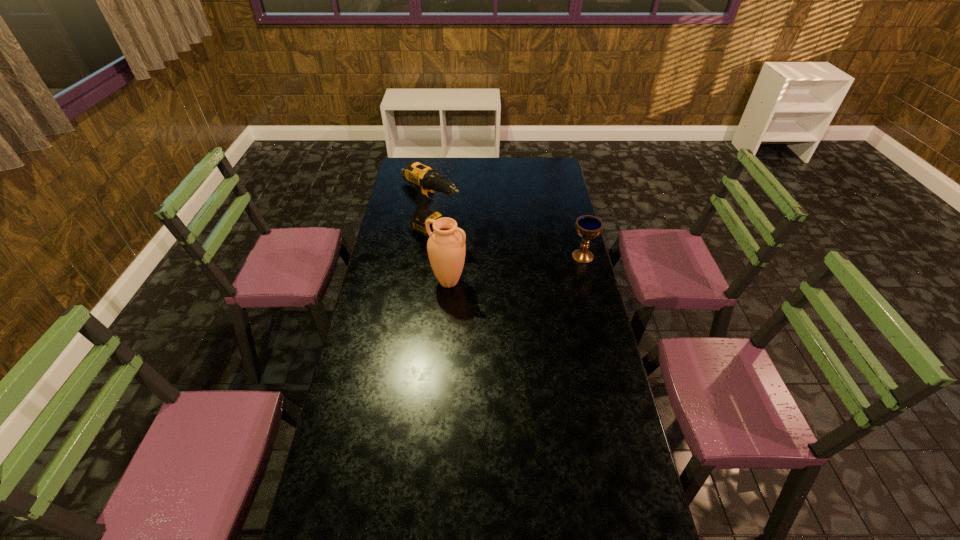
Identify the location of vacant point located on the head of the shortest object. (461, 225).

Find the location of a particular element. Image resolution: width=960 pixels, height=540 pixels. vacant space located at the tip of the drill is located at coordinates (507, 263).

I want to click on vacant space located at the tip of the drill, so [x=507, y=263].

You are a GUI agent. You are given a task and a screenshot of the screen. Output one action in this format:
    pyautogui.click(x=<x>, y=<y>)
    Task: Click on the free space located 0.260m at the tip of the drill
    This screenshot has height=540, width=960.
    Given the screenshot: What is the action you would take?
    pyautogui.click(x=505, y=262)

Where is `object at the far edge`? This screenshot has width=960, height=540. object at the far edge is located at coordinates (401, 171).

This screenshot has width=960, height=540. I want to click on electric shaver located in the left edge section of the desktop, so click(x=401, y=171).

The width and height of the screenshot is (960, 540). In order to click on drill that is at the left edge in this screenshot , I will do `click(427, 181)`.

Identify the location of object at the right edge. (588, 227).

I want to click on object present at the far left corner, so click(401, 171).

Image resolution: width=960 pixels, height=540 pixels. In order to click on free point at the far edge in this screenshot , I will do `click(496, 159)`.